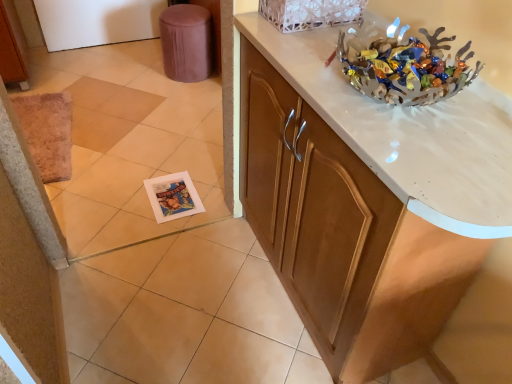
Question: Considering the relative positions of brown fabric stool at upper left and metallic silver bowl at upper right in the image provided, is brown fabric stool at upper left to the left or to the right of metallic silver bowl at upper right?

Choices:
 (A) left
 (B) right

Answer: (A)

Question: Is point (170, 46) positioned closer to the camera than point (428, 62)?

Choices:
 (A) closer
 (B) farther

Answer: (B)

Question: Based on their relative distances, which object is nearer to the white marble countertop at upper right?

Choices:
 (A) brown fabric stool at upper left
 (B) white lace basket at upper center
 (C) metallic silver bowl at upper right

Answer: (C)

Question: Which object is the farthest from the brown fabric stool at upper left?

Choices:
 (A) metallic silver bowl at upper right
 (B) white lace basket at upper center
 (C) white marble countertop at upper right

Answer: (A)